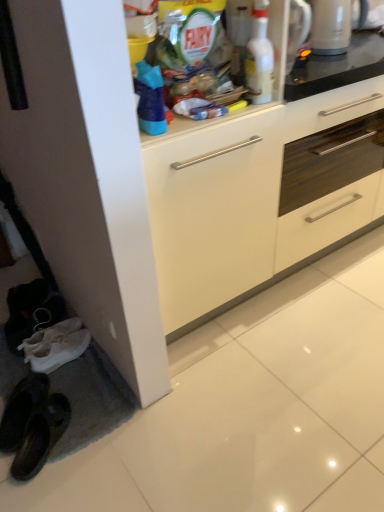
Question: In the image, is white glossy cabinet at center positioned in front of or behind white glossy kettle at upper right?

Choices:
 (A) front
 (B) behind

Answer: (A)

Question: From a real-world perspective, is white glossy cabinet at center physically located above or below white glossy kettle at upper right?

Choices:
 (A) below
 (B) above

Answer: (A)

Question: Which object is positioned closest to the white glossy bottle at upper center?

Choices:
 (A) white glossy cabinet at center
 (B) white glossy kettle at upper right

Answer: (B)

Question: Estimate the real-world distances between objects in this image. Which object is closer to the white glossy kettle at upper right?

Choices:
 (A) white glossy bottle at upper center
 (B) white glossy cabinet at center

Answer: (A)